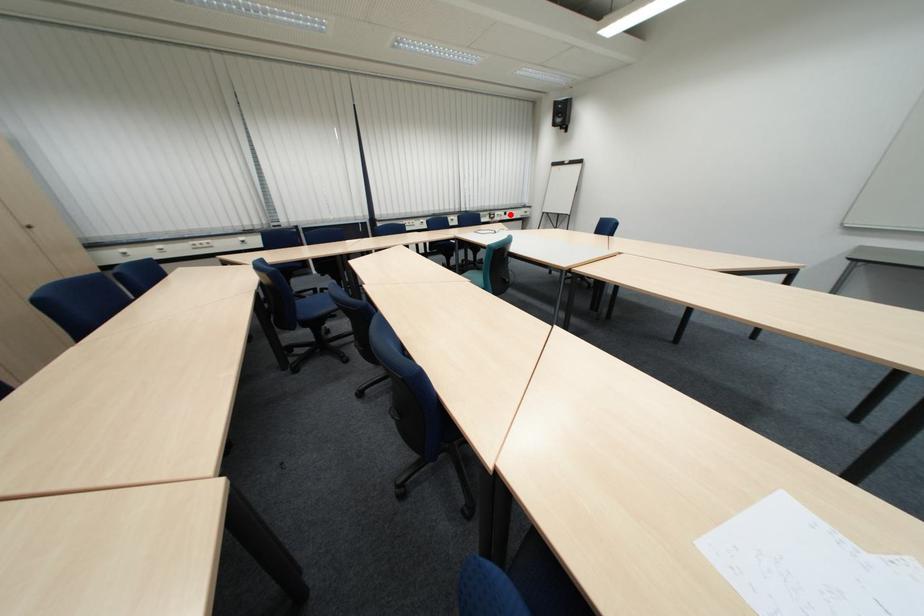
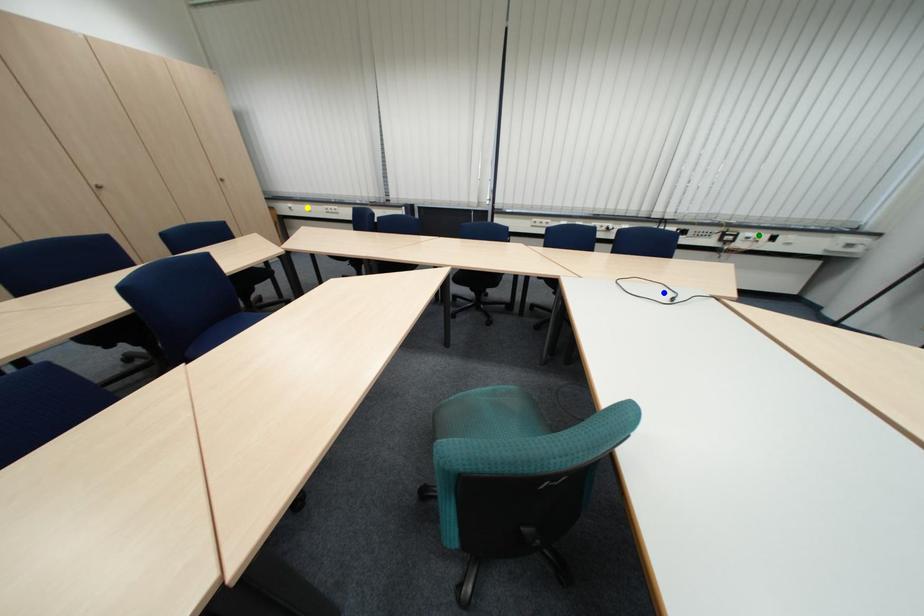
Question: I am providing you with two images of the same scene from different viewpoints. A red point is marked on the first image. You are given multiple points on the second image. Which mark in image 2 goes with the point in image 1?

Choices:
 (A) green point
 (B) blue point
 (C) yellow point

Answer: (A)